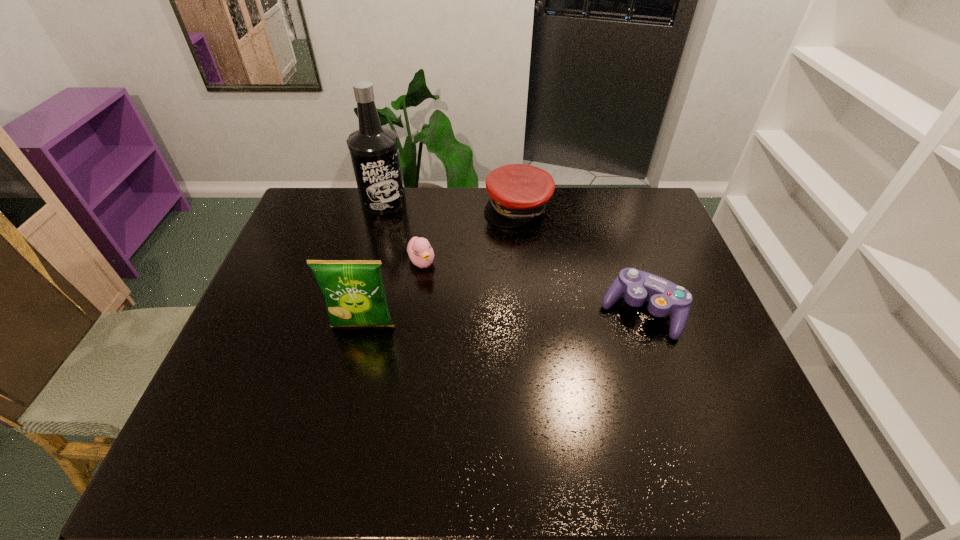
Where is `the second tallest object`? This screenshot has width=960, height=540. the second tallest object is located at coordinates (354, 291).

Where is `control`? The width and height of the screenshot is (960, 540). control is located at coordinates (663, 296).

You are a GUI agent. You are given a task and a screenshot of the screen. Output one action in this format:
    pyautogui.click(x=<x>, y=<y>)
    Task: Click on the fourth object from left to right
    Image resolution: width=960 pixels, height=540 pixels.
    Given the screenshot: What is the action you would take?
    pyautogui.click(x=518, y=193)

Where is `the tallest object`? Image resolution: width=960 pixels, height=540 pixels. the tallest object is located at coordinates (374, 150).

The height and width of the screenshot is (540, 960). Identify the location of duckling. (420, 252).

Locate an element on the screen. This screenshot has height=540, width=960. the third nearest object is located at coordinates [x=420, y=252].

Identify the location of free region located on the front-facing side of the crisp (potato chip). (344, 406).

The width and height of the screenshot is (960, 540). I want to click on vacant space situated 0.300m on the back of the control, so click(611, 222).

Identify the location of vacant space located 0.140m on the front-facing side of the cap. (530, 256).

In order to click on vacant space located 0.390m on the front-facing side of the cap in this screenshot , I will do `click(544, 319)`.